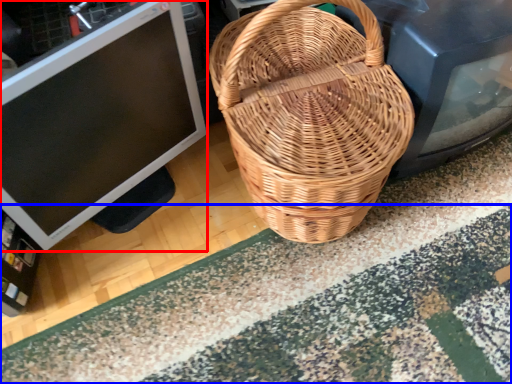
Question: Which of the following is the farthest to the observer, computer monitor (highlighted by a red box) or doormat (highlighted by a blue box)?

Choices:
 (A) computer monitor
 (B) doormat

Answer: (B)